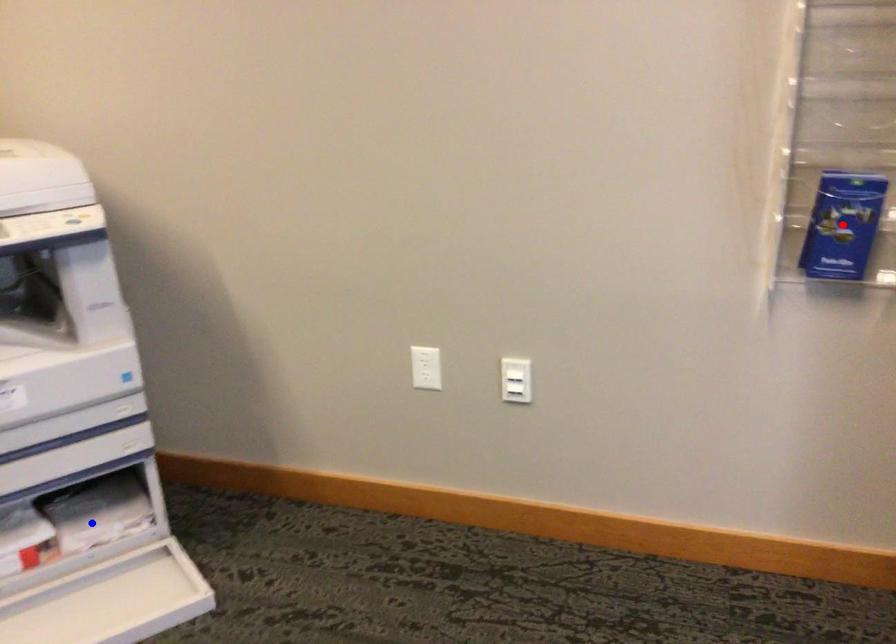
Question: Two points are marked on the image. Which point is closer to the camera?

Choices:
 (A) Blue point is closer.
 (B) Red point is closer.

Answer: (B)